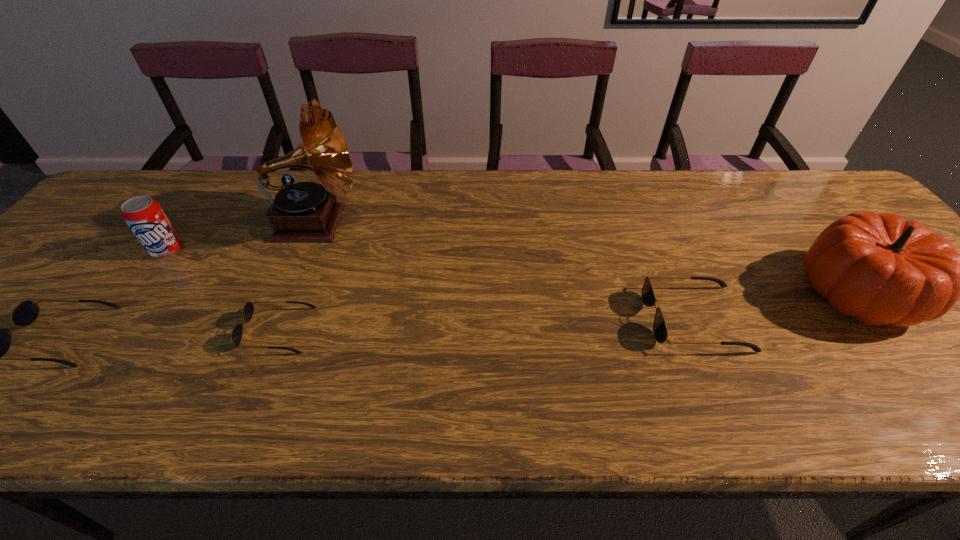
In order to click on the second sunglasses from left to right in this screenshot , I will do `click(248, 310)`.

The height and width of the screenshot is (540, 960). Identify the location of the shortest object. (248, 310).

Locate an element on the screen. The height and width of the screenshot is (540, 960). the rightmost sunglasses is located at coordinates (660, 330).

Identify the location of the fifth object from left to right. The height and width of the screenshot is (540, 960). (660, 330).

Find the location of a particular element. The image size is (960, 540). phonograph_record is located at coordinates (305, 211).

Find the location of a particular element. The width and height of the screenshot is (960, 540). the fourth shortest object is located at coordinates click(x=144, y=216).

The width and height of the screenshot is (960, 540). Find the location of `free space located 0.060m on the front-facing side of the shortest sunglasses`. free space located 0.060m on the front-facing side of the shortest sunglasses is located at coordinates (218, 330).

Find the location of `vacant area located on the front-facing side of the shortest sunglasses`. vacant area located on the front-facing side of the shortest sunglasses is located at coordinates (213, 330).

The width and height of the screenshot is (960, 540). Identify the location of free region located 0.370m on the front-facing side of the shortest sunglasses. (75, 330).

This screenshot has width=960, height=540. In order to click on free region located on the front-facing side of the rightmost sunglasses in this screenshot , I will do `click(472, 318)`.